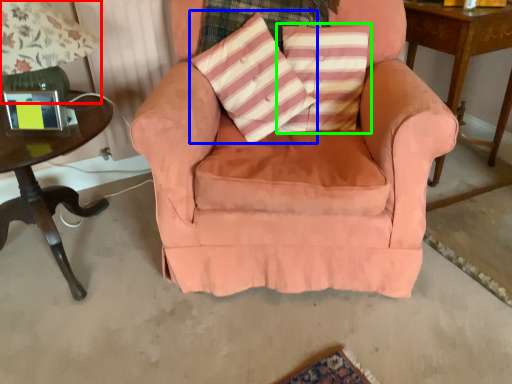
Question: Which is farther away from table lamp (highlighted by a red box)? throw pillow (highlighted by a blue box) or pillow (highlighted by a green box)?

Choices:
 (A) throw pillow
 (B) pillow

Answer: (B)